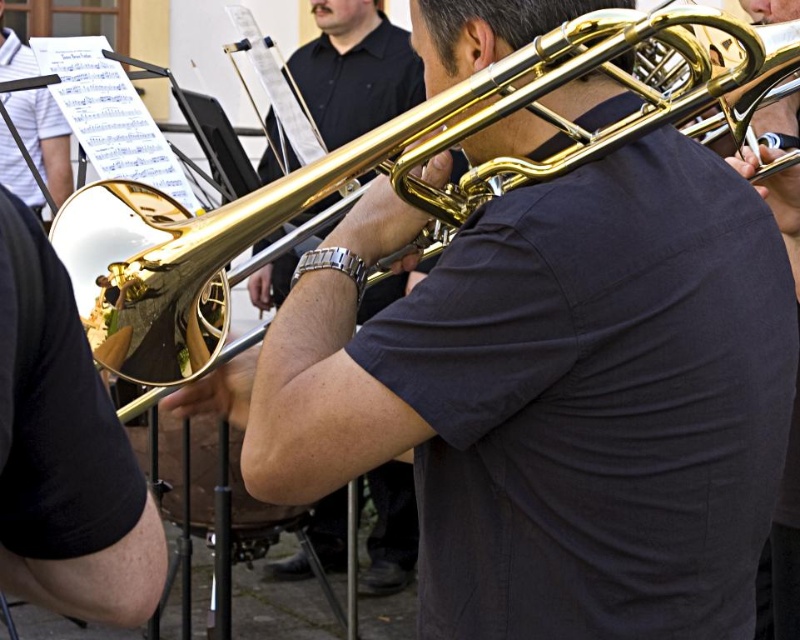
Question: Considering the real-world distances, which object is farthest from the gold shiny trumpet at center?

Choices:
 (A) gold shiny trombone at center
 (B) silver metallic watch at center

Answer: (A)

Question: Does gold shiny trombone at center have a lesser width compared to silver metallic watch at center?

Choices:
 (A) no
 (B) yes

Answer: (A)

Question: Does gold shiny trombone at center appear on the right side of silver metallic watch at center?

Choices:
 (A) no
 (B) yes

Answer: (A)

Question: Is gold shiny trumpet at center further to the viewer compared to gold shiny trombone at center?

Choices:
 (A) yes
 (B) no

Answer: (B)

Question: Which point is closer to the camera?

Choices:
 (A) (358, 260)
 (B) (130, 289)
 (C) (384, 474)

Answer: (A)

Question: Which point is farther to the camera?

Choices:
 (A) (424, 161)
 (B) (350, 256)
 (C) (318, 536)

Answer: (C)